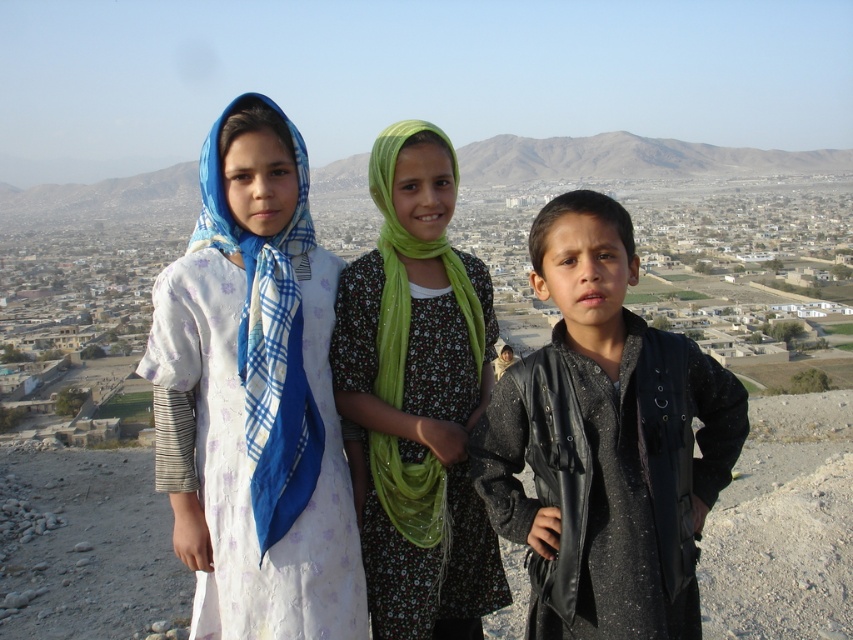
You are a photographer trying to capture the scene of the three children on the rocky terrain. You want to ensure both the white floral dress at center and the green fabric scarf at center are clearly visible in your photo. Given their size relationship, which object should you focus on to ensure both are in frame?

The white floral dress at center is larger in size than the green fabric scarf at center, so focusing on the larger white floral dress at center will help ensure both are visible in the photo.

You are a photographer trying to capture the white floral dress at center in the image. The camera is set to focus on the point at coordinates point [260,392]. Based on the scene description, will the camera focus on the correct subject?

Yes, the camera will focus on the correct subject because the point [260,392] marks the white floral dress at center.